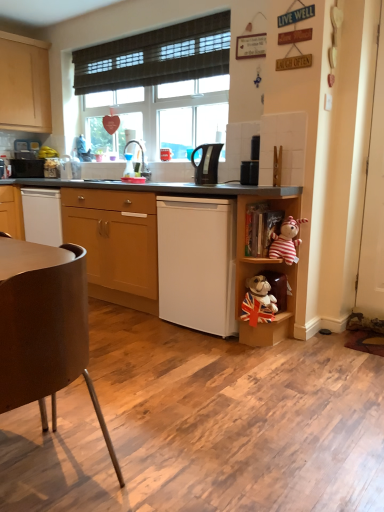
Identify the location of vacant space to the right of brown matte chair at lower left. (168, 438).